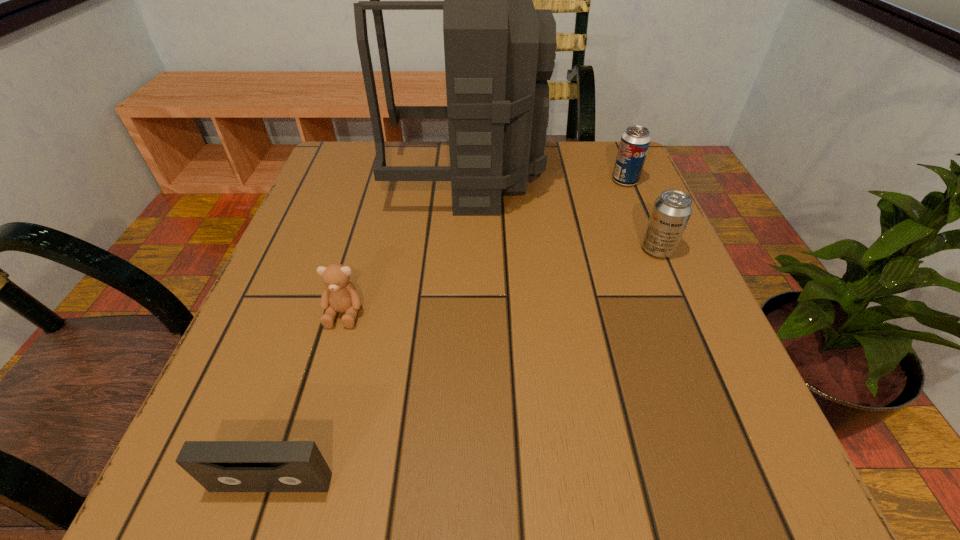
Locate an element on the screen. Image resolution: width=960 pixels, height=540 pixels. backpack is located at coordinates (499, 50).

Find the location of a particular element. This screenshot has height=540, width=960. the farther beer can is located at coordinates (635, 141).

The width and height of the screenshot is (960, 540). I want to click on the third nearest object, so click(671, 212).

Where is `teddy bear`? teddy bear is located at coordinates (340, 295).

Where is `the nearest object`? The width and height of the screenshot is (960, 540). the nearest object is located at coordinates (219, 466).

Locate an element on the screen. Image resolution: width=960 pixels, height=540 pixels. vacant region located on the front compartment of the tallest object is located at coordinates (618, 178).

Locate an element on the screen. free space located on the left of the farther beer can is located at coordinates (528, 181).

This screenshot has height=540, width=960. Identify the location of vacant space located 0.260m on the back of the third farthest object. (622, 167).

The width and height of the screenshot is (960, 540). I want to click on vacant area located 0.230m on the front-facing side of the second nearest object, so click(297, 480).

At what (x,y) coordinates should I click in order to perform the action: click on backpack situated at the far edge. Please return your answer as a coordinate pair (x, y). The width and height of the screenshot is (960, 540). Looking at the image, I should click on (499, 50).